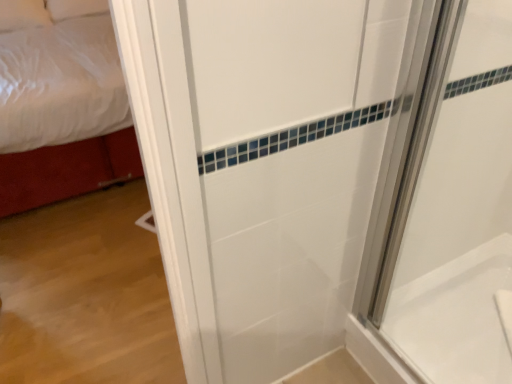
Question: Considering the relative sizes of white glossy bathtub at lower right and white glossy shower door at right in the image provided, is white glossy bathtub at lower right wider than white glossy shower door at right?

Choices:
 (A) no
 (B) yes

Answer: (B)

Question: From a real-world perspective, does white glossy bathtub at lower right sit lower than white glossy shower door at right?

Choices:
 (A) no
 (B) yes

Answer: (B)

Question: Does white glossy bathtub at lower right appear on the left side of white glossy shower door at right?

Choices:
 (A) yes
 (B) no

Answer: (B)

Question: Can you confirm if white glossy bathtub at lower right is bigger than white glossy shower door at right?

Choices:
 (A) yes
 (B) no

Answer: (A)

Question: Does white glossy bathtub at lower right appear on the right side of white glossy shower door at right?

Choices:
 (A) yes
 (B) no

Answer: (A)

Question: Does white glossy bathtub at lower right turn towards white glossy shower door at right?

Choices:
 (A) yes
 (B) no

Answer: (B)

Question: Does white fabric bed at left contain white glossy bathtub at lower right?

Choices:
 (A) no
 (B) yes

Answer: (A)

Question: Is the depth of white fabric bed at left greater than that of white glossy bathtub at lower right?

Choices:
 (A) no
 (B) yes

Answer: (B)

Question: Does white fabric bed at left have a greater width compared to white glossy bathtub at lower right?

Choices:
 (A) yes
 (B) no

Answer: (A)

Question: From the image's perspective, is white fabric bed at left below white glossy bathtub at lower right?

Choices:
 (A) yes
 (B) no

Answer: (B)

Question: Is there a large distance between white fabric bed at left and white glossy bathtub at lower right?

Choices:
 (A) yes
 (B) no

Answer: (A)

Question: Is white fabric bed at left with white glossy bathtub at lower right?

Choices:
 (A) yes
 (B) no

Answer: (B)

Question: Are white glossy bathtub at lower right and white fabric bed at left making contact?

Choices:
 (A) yes
 (B) no

Answer: (B)